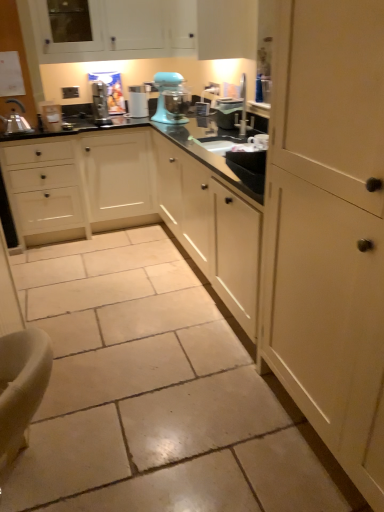
Question: Which direction should I rotate to face white matte cabinet at upper center, the first cabinetry when ordered from top to bottom, — up or down?

Choices:
 (A) down
 (B) up

Answer: (B)

Question: Is white matte cabinet at upper center, which appears as the second cabinetry when viewed from the front, at the left side of white glossy sink at center?

Choices:
 (A) yes
 (B) no

Answer: (A)

Question: Does white matte cabinet at upper center, which is the 2th cabinetry in right-to-left order, come in front of white glossy sink at center?

Choices:
 (A) yes
 (B) no

Answer: (B)

Question: Is white matte cabinet at upper center, which is the 2th cabinetry in right-to-left order, touching white glossy sink at center?

Choices:
 (A) no
 (B) yes

Answer: (A)

Question: From the image's perspective, is white matte cabinet at upper center, which is counted as the 1th cabinetry, starting from the back, on white glossy sink at center?

Choices:
 (A) yes
 (B) no

Answer: (A)

Question: Can you confirm if white matte cabinet at upper center, which is counted as the 1th cabinetry, starting from the back, is taller than white glossy sink at center?

Choices:
 (A) no
 (B) yes

Answer: (B)

Question: Could you tell me if white matte cabinet at upper center, which appears as the second cabinetry when viewed from the front, is turned towards white glossy sink at center?

Choices:
 (A) yes
 (B) no

Answer: (A)

Question: Is black glossy countertop at center thinner than matte cream cabinet at right, which is counted as the 1th cabinetry, starting from the bottom?

Choices:
 (A) yes
 (B) no

Answer: (B)

Question: Does black glossy countertop at center turn towards matte cream cabinet at right, which is the second cabinetry from top to bottom?

Choices:
 (A) yes
 (B) no

Answer: (A)

Question: From a real-world perspective, does black glossy countertop at center sit lower than matte cream cabinet at right, the 2th cabinetry from the left?

Choices:
 (A) yes
 (B) no

Answer: (A)

Question: Could matte cream cabinet at right, which appears as the first cabinetry when viewed from the front, be considered to be inside black glossy countertop at center?

Choices:
 (A) no
 (B) yes

Answer: (A)

Question: Can you confirm if black glossy countertop at center is shorter than matte cream cabinet at right, which is the second cabinetry from top to bottom?

Choices:
 (A) no
 (B) yes

Answer: (B)

Question: Does black glossy countertop at center have a larger size compared to matte cream cabinet at right, positioned as the first cabinetry in right-to-left order?

Choices:
 (A) no
 (B) yes

Answer: (B)

Question: Is black glossy countertop at center smaller than teal matte stand mixer at center?

Choices:
 (A) yes
 (B) no

Answer: (B)